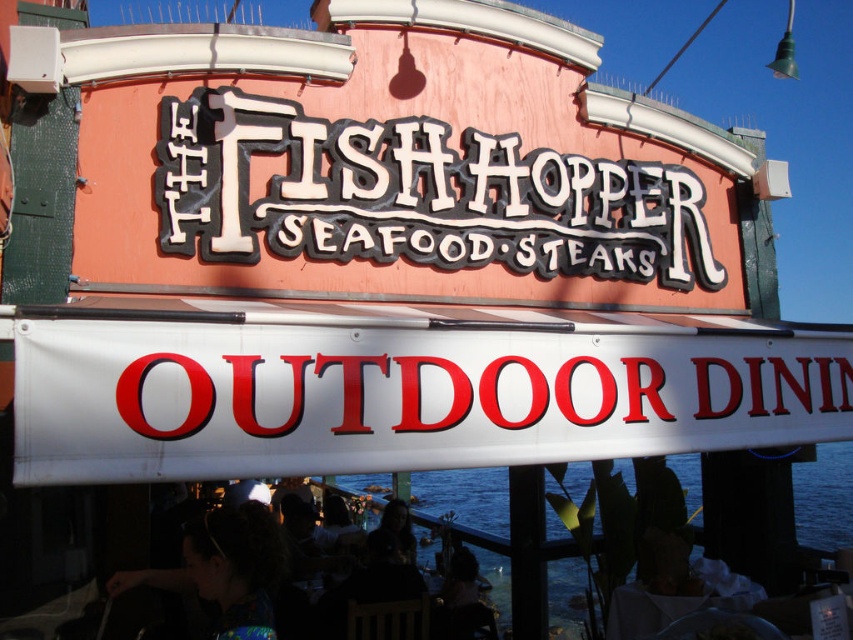
Consider the image. Is black plastic sign at center positioned at the back of white glossy signboard at center?

Yes, black plastic sign at center is further from the viewer.

Is black plastic sign at center closer to the viewer compared to white glossy signboard at center?

No.

What do you see at coordinates (418, 196) in the screenshot? This screenshot has width=853, height=640. I see `black plastic sign at center` at bounding box center [418, 196].

Where is `black plastic sign at center`? black plastic sign at center is located at coordinates (418, 196).

Between black plastic sign at center and transparent water at lower center, which one has more height?

With more height is transparent water at lower center.

What are the coordinates of `black plastic sign at center` in the screenshot? It's located at (418, 196).

The width and height of the screenshot is (853, 640). Identify the location of black plastic sign at center. (418, 196).

Can you confirm if white glossy signboard at center is bigger than transparent water at lower center?

Incorrect, white glossy signboard at center is not larger than transparent water at lower center.

Does white glossy signboard at center have a greater width compared to transparent water at lower center?

No, white glossy signboard at center is not wider than transparent water at lower center.

Who is more distant from viewer, (200, 365) or (830, 508)?

Positioned behind is point (830, 508).

You are a GUI agent. You are given a task and a screenshot of the screen. Output one action in this format:
    pyautogui.click(x=<x>, y=<y>)
    Task: Click on the white glossy signboard at center
    The width and height of the screenshot is (853, 640).
    Given the screenshot: What is the action you would take?
    pyautogui.click(x=465, y=392)